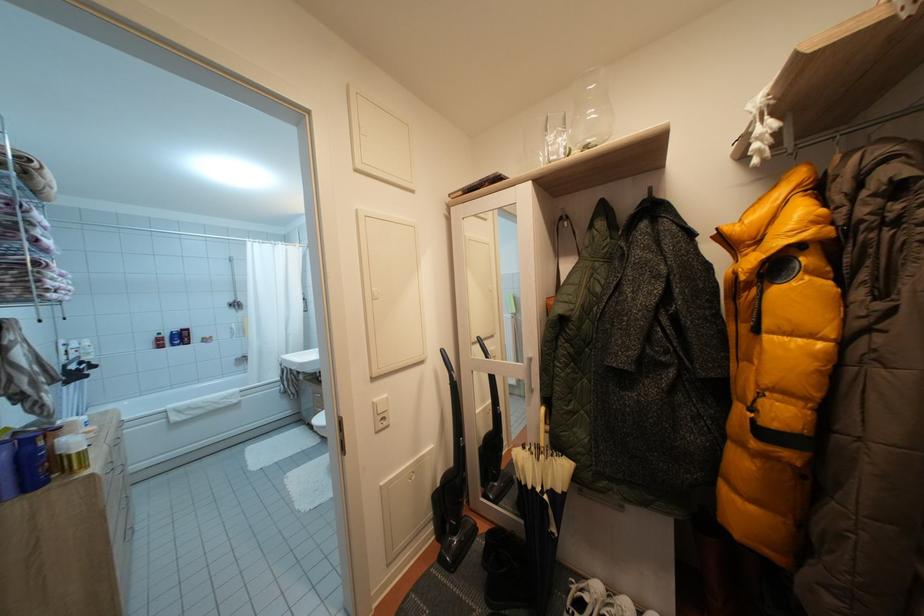
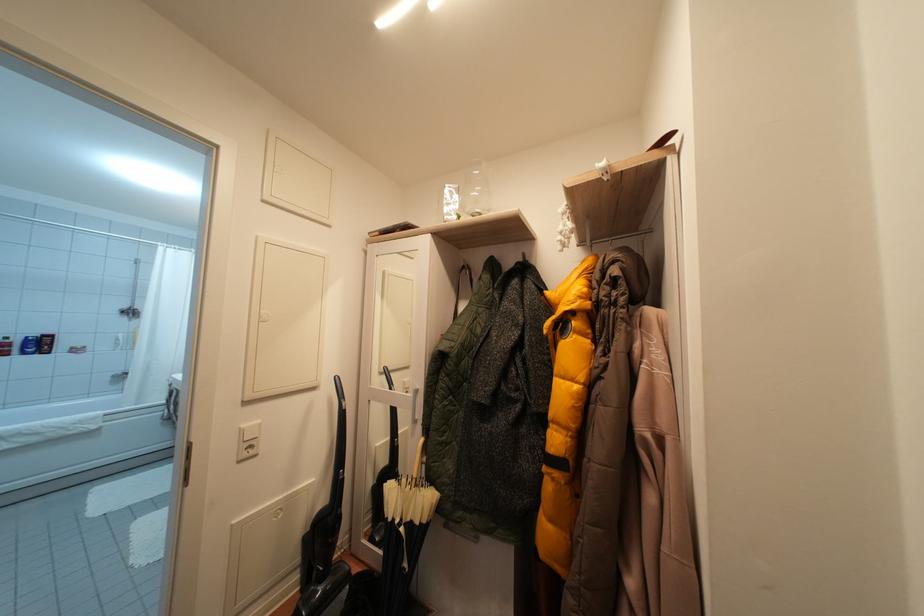
Locate, in the second image, the point that corresponds to point 532,367 in the first image.

(419, 398)